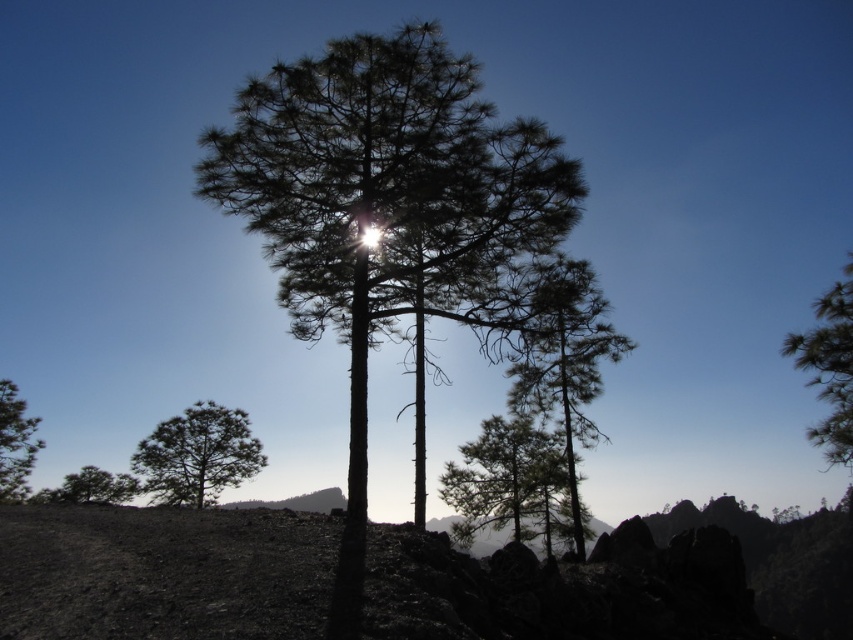
Does burnt soil at lower left have a greater width compared to green matte tree at upper right?

Yes.

Does point (717, 620) come behind point (811, 332)?

Yes, point (717, 620) is farther from viewer.

Does point (126, 522) come closer to viewer compared to point (848, 396)?

Yes, point (126, 522) is in front of point (848, 396).

Identify the location of burnt soil at lower left. (161, 573).

Who is lower down, burnt soil at lower left or silhouette pine tree at center?

Positioned lower is burnt soil at lower left.

Which of these two, burnt soil at lower left or silhouette pine tree at center, stands shorter?

Standing shorter between the two is silhouette pine tree at center.

At what (x,y) coordinates should I click in order to perform the action: click on burnt soil at lower left. Please return your answer as a coordinate pair (x, y). The image size is (853, 640). Looking at the image, I should click on (161, 573).

This screenshot has width=853, height=640. In order to click on burnt soil at lower left in this screenshot , I will do `click(161, 573)`.

Can you confirm if green matte tree at center is positioned below silvery textured tree at lower left?

No, green matte tree at center is not below silvery textured tree at lower left.

Measure the distance between green matte tree at center and camera.

green matte tree at center is 13.23 meters from camera.

Where is `green matte tree at center`? The image size is (853, 640). green matte tree at center is located at coordinates (561, 356).